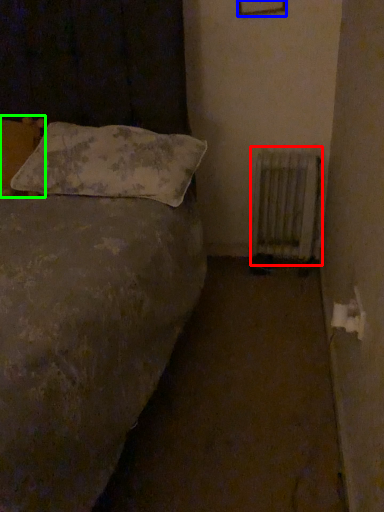
Question: Which is farther away from radiator (highlighted by a red box)? picture frame (highlighted by a blue box) or pillow (highlighted by a green box)?

Choices:
 (A) picture frame
 (B) pillow

Answer: (B)